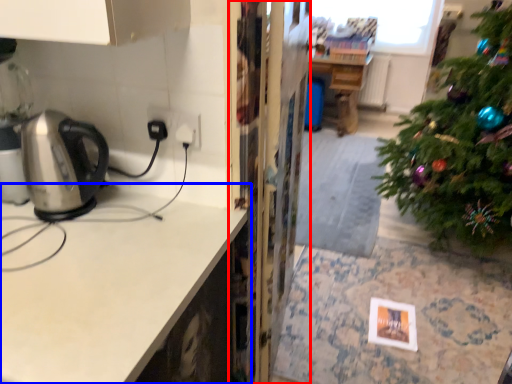
Question: Which of the following is the closest to the observer, screen door (highlighted by a red box) or countertop (highlighted by a blue box)?

Choices:
 (A) screen door
 (B) countertop

Answer: (B)